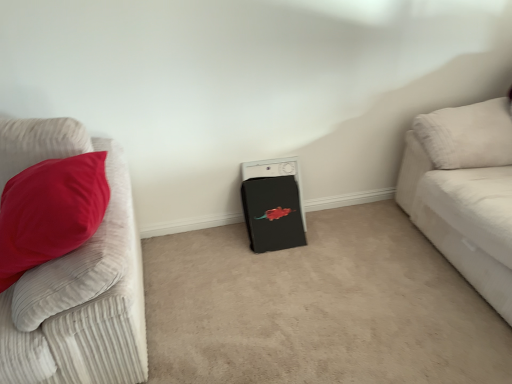
Question: Does white corduroy couch at right, the first studio couch viewed from the right, come behind black matte washing machine at center?

Choices:
 (A) no
 (B) yes

Answer: (A)

Question: Considering the relative sizes of white corduroy couch at right, the 2th studio couch when ordered from left to right, and black matte washing machine at center in the image provided, is white corduroy couch at right, the 2th studio couch when ordered from left to right, taller than black matte washing machine at center?

Choices:
 (A) no
 (B) yes

Answer: (B)

Question: From the image's perspective, would you say white corduroy couch at right, the first studio couch viewed from the right, is positioned over black matte washing machine at center?

Choices:
 (A) yes
 (B) no

Answer: (A)

Question: Is white corduroy couch at right, the 2th studio couch when ordered from left to right, looking in the opposite direction of black matte washing machine at center?

Choices:
 (A) yes
 (B) no

Answer: (B)

Question: Is white corduroy couch at right, the first studio couch viewed from the right, far away from black matte washing machine at center?

Choices:
 (A) no
 (B) yes

Answer: (A)

Question: From a real-world perspective, is black matte washing machine at center physically located above or below white corduroy couch at right, the first studio couch viewed from the right?

Choices:
 (A) above
 (B) below

Answer: (B)

Question: Is black matte washing machine at center inside the boundaries of white corduroy couch at right, the first studio couch viewed from the right, or outside?

Choices:
 (A) outside
 (B) inside

Answer: (A)

Question: Does point (262, 236) appear closer or farther from the camera than point (458, 198)?

Choices:
 (A) closer
 (B) farther

Answer: (B)

Question: Considering the positions of black matte washing machine at center and white corduroy couch at right, the 2th studio couch when ordered from left to right, in the image, is black matte washing machine at center taller or shorter than white corduroy couch at right, the 2th studio couch when ordered from left to right,?

Choices:
 (A) short
 (B) tall

Answer: (A)

Question: Considering the positions of velvet red pillow at left, placed as the 2th studio couch when sorted from right to left, and white corduroy couch at right, the first studio couch viewed from the right, in the image, is velvet red pillow at left, placed as the 2th studio couch when sorted from right to left, taller or shorter than white corduroy couch at right, the first studio couch viewed from the right,?

Choices:
 (A) tall
 (B) short

Answer: (B)

Question: From a real-world perspective, is velvet red pillow at left, placed as the 1th studio couch when sorted from left to right, above or below white corduroy couch at right, the first studio couch viewed from the right?

Choices:
 (A) below
 (B) above

Answer: (B)

Question: In terms of size, does velvet red pillow at left, placed as the 2th studio couch when sorted from right to left, appear bigger or smaller than white corduroy couch at right, the first studio couch viewed from the right?

Choices:
 (A) small
 (B) big

Answer: (A)

Question: From the image's perspective, is velvet red pillow at left, placed as the 1th studio couch when sorted from left to right, positioned above or below white corduroy couch at right, the first studio couch viewed from the right?

Choices:
 (A) below
 (B) above

Answer: (A)

Question: Does point (105, 248) appear closer or farther from the camera than point (243, 203)?

Choices:
 (A) closer
 (B) farther

Answer: (A)

Question: Based on their sizes in the image, would you say velvet red pillow at left, placed as the 2th studio couch when sorted from right to left, is bigger or smaller than black matte washing machine at center?

Choices:
 (A) big
 (B) small

Answer: (A)